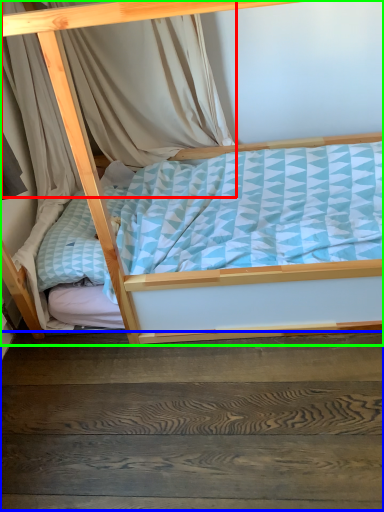
Question: Which object is the farthest from curtain (highlighted by a red box)? Choose among these: stairwell (highlighted by a blue box) or bed (highlighted by a green box).

Choices:
 (A) stairwell
 (B) bed

Answer: (A)